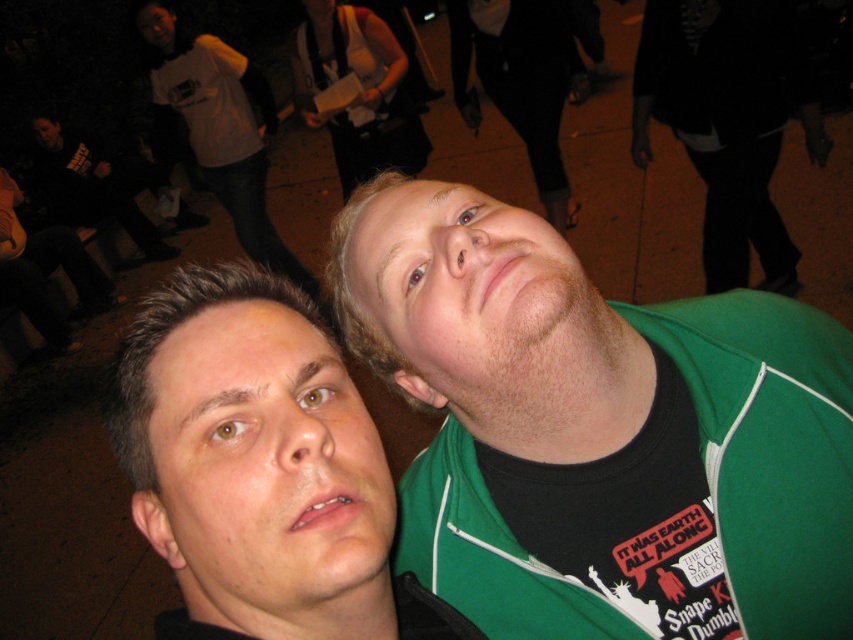
Between green fabric shirt at upper right and white cotton shirt at upper left, which one appears on the left side from the viewer's perspective?

Positioned to the left is white cotton shirt at upper left.

Is green fabric shirt at upper right positioned in front of white cotton shirt at upper left?

Yes.

Does point (486, 406) lie behind point (152, 20)?

No.

Identify the location of green fabric shirt at upper right. This screenshot has height=640, width=853. (599, 432).

Does green fabric shirt at upper right come behind matte black jacket at upper left?

No, green fabric shirt at upper right is in front of matte black jacket at upper left.

What do you see at coordinates (599, 432) in the screenshot? I see `green fabric shirt at upper right` at bounding box center [599, 432].

Image resolution: width=853 pixels, height=640 pixels. In order to click on green fabric shirt at upper right in this screenshot , I will do `click(599, 432)`.

Measure the distance between point (x=366, y=577) and camera.

A distance of 45.63 centimeters exists between point (x=366, y=577) and camera.

Is matte black face at center closer to the viewer compared to white cotton shirt at upper left?

Yes, it is.

Identify the location of matte black face at center. The width and height of the screenshot is (853, 640). (259, 468).

The width and height of the screenshot is (853, 640). What are the coordinates of `matte black face at center` in the screenshot? It's located at (259, 468).